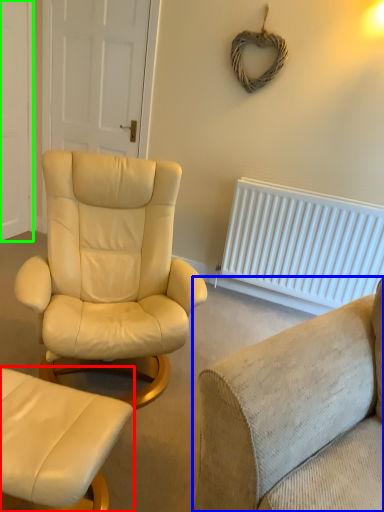
Question: Estimate the real-world distances between objects in this image. Which object is farther from chair (highlighted by a red box), studio couch (highlighted by a blue box) or door (highlighted by a green box)?

Choices:
 (A) studio couch
 (B) door

Answer: (B)